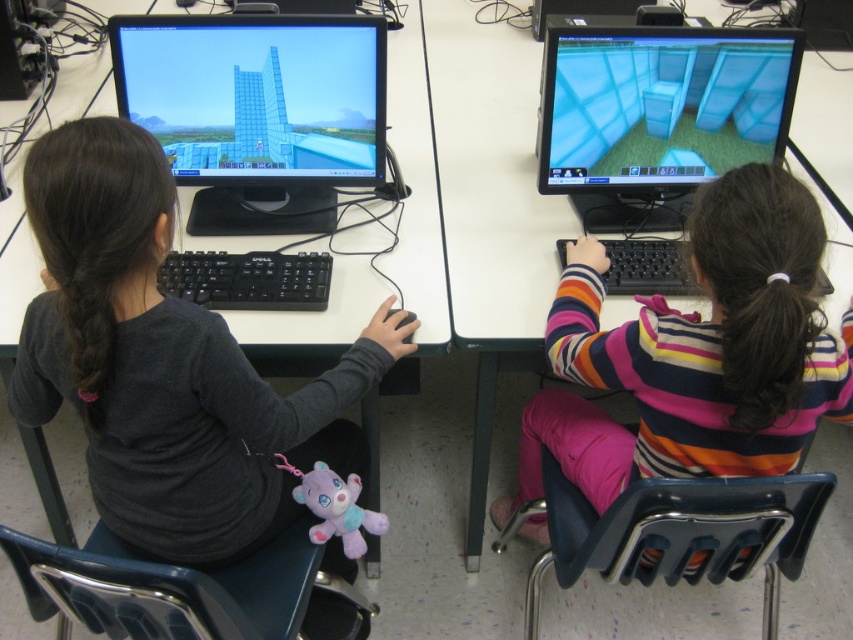
Question: Is dark gray shirt at left bigger than striped sweater at right?

Choices:
 (A) yes
 (B) no

Answer: (B)

Question: Based on their relative distances, which object is nearer to the striped sweater at right?

Choices:
 (A) transparent glass computer monitor at upper right
 (B) transparent glass monitor at upper left
 (C) purple plush toy at lower center

Answer: (A)

Question: Does dark gray shirt at left appear under purple plush toy at lower center?

Choices:
 (A) yes
 (B) no

Answer: (B)

Question: Does transparent glass monitor at upper left appear on the left side of purple plush toy at lower center?

Choices:
 (A) no
 (B) yes

Answer: (B)

Question: Which object is the farthest from the transparent glass monitor at upper left?

Choices:
 (A) purple plush toy at lower center
 (B) transparent glass computer monitor at upper right
 (C) striped sweater at right
 (D) dark gray shirt at left

Answer: (A)

Question: Which point is closer to the camera?

Choices:
 (A) coord(358,484)
 (B) coord(305,100)
 (C) coord(746,129)
 (D) coord(805,208)

Answer: (D)